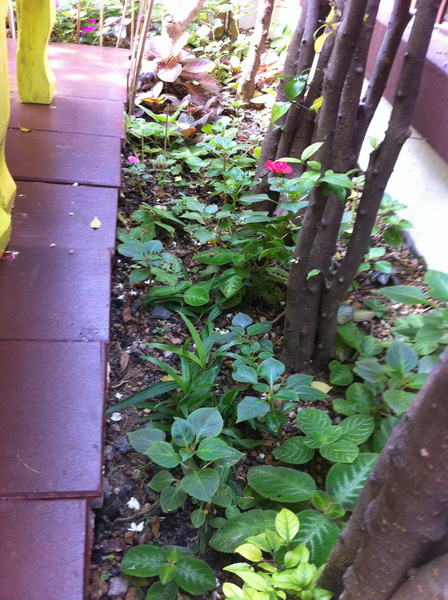
Where is `yellow painted wood`? This screenshot has height=600, width=448. yellow painted wood is located at coordinates (6, 224), (9, 195), (5, 79), (38, 19).